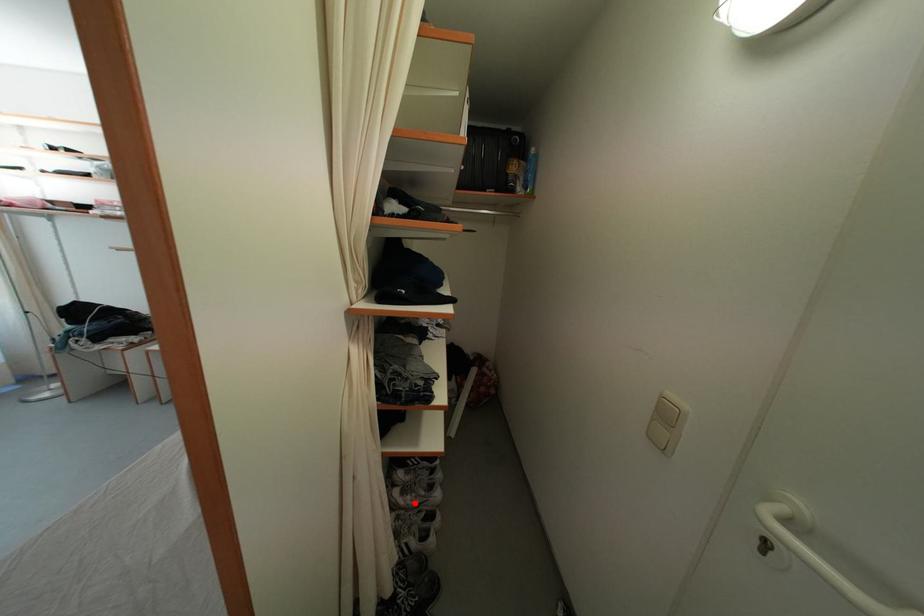
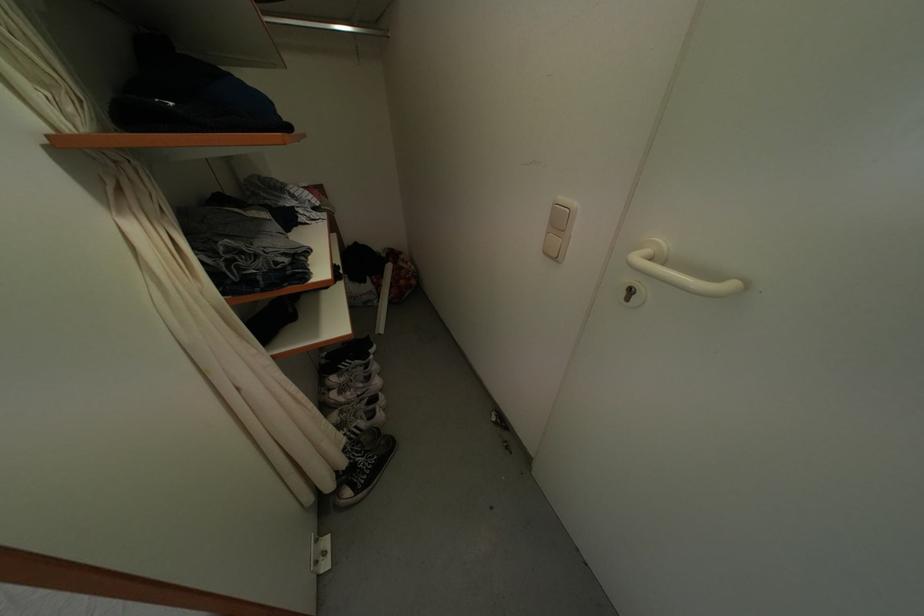
In the second image, find the point that corresponds to the highlighted location in the first image.

(354, 399)